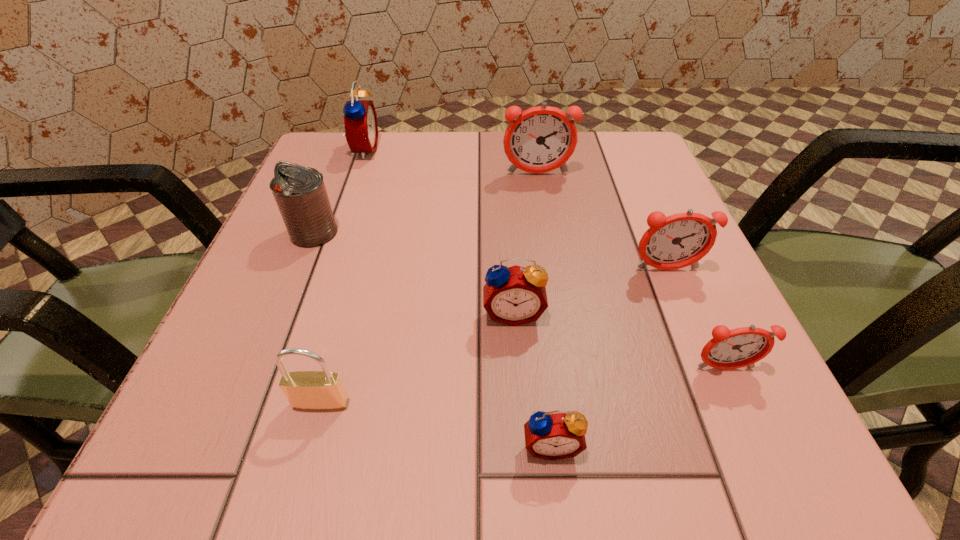
Where is `the leftmost red alarm clock`? Image resolution: width=960 pixels, height=540 pixels. the leftmost red alarm clock is located at coordinates (360, 118).

You are a GUI agent. You are given a task and a screenshot of the screen. Output one action in this format:
    pyautogui.click(x=<x>, y=<y>)
    Task: Click on the biggest red alarm clock
    Image resolution: width=960 pixels, height=540 pixels.
    Given the screenshot: What is the action you would take?
    pyautogui.click(x=360, y=118)

This screenshot has height=540, width=960. I want to click on the fifth nearest alarm clock, so click(540, 139).

This screenshot has width=960, height=540. What are the coordinates of `the farthest reddish-pink alarm clock` in the screenshot? It's located at (540, 139).

Find the location of a particular element. can is located at coordinates (299, 191).

This screenshot has width=960, height=540. What are the coordinates of `the third farthest alarm clock` in the screenshot? It's located at (680, 240).

This screenshot has height=540, width=960. I want to click on the second biggest reddish-pink alarm clock, so click(680, 240).

Image resolution: width=960 pixels, height=540 pixels. Identify the location of the second smallest red alarm clock. click(515, 295).

Locate an element on the screen. the fourth nearest object is located at coordinates click(515, 295).

What are the coordinates of `padlock` in the screenshot? It's located at (323, 390).